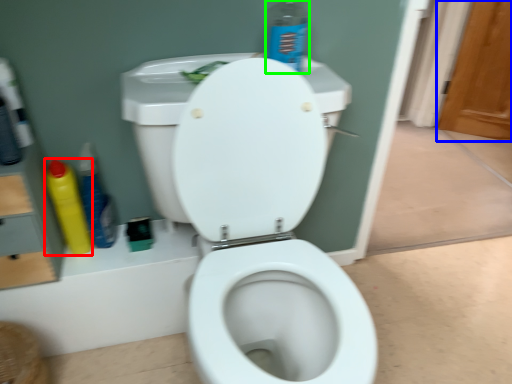
Question: Considering the real-world distances, which object is farthest from cleaning product (highlighted by a red box)? screen door (highlighted by a blue box) or cleaning product (highlighted by a green box)?

Choices:
 (A) screen door
 (B) cleaning product

Answer: (A)